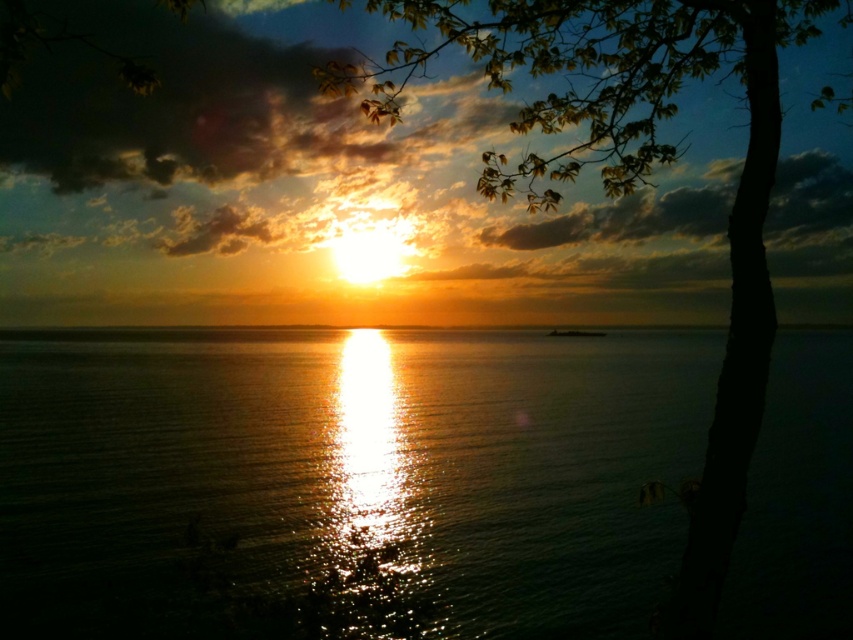
Question: Among these points, which one is farthest from the camera?

Choices:
 (A) (138, 518)
 (B) (740, 388)

Answer: (A)

Question: Where is shiny reflective water at center located in relation to green leafy tree at upper right in the image?

Choices:
 (A) left
 (B) right

Answer: (A)

Question: Does shiny reflective water at center appear under green leafy tree at upper right?

Choices:
 (A) yes
 (B) no

Answer: (A)

Question: Does shiny reflective water at center appear under green leafy tree at upper right?

Choices:
 (A) no
 (B) yes

Answer: (B)